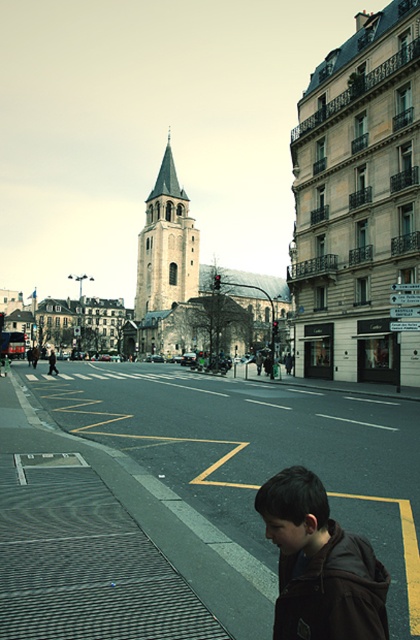
You are standing at the pedestrian crossing in the European city scene. You need to reach the stone steeple at center from your current position. The brown leather jacket at lower right is an obstacle. Given that the jacket is 154.38 meters away from the steeple, will you have enough space to walk around it without getting too close?

The brown leather jacket at lower right is 154.38 meters away from the stone steeple at center. Since the distance between them is quite large, you should have sufficient space to walk around the jacket without getting too close.

You are a delivery person needing to cross the street. You see the brown leather jacket at lower right and the stone steeple at center. Which object is smaller in size?

The brown leather jacket at lower right is smaller in size than the stone steeple at center because it occupies less space.